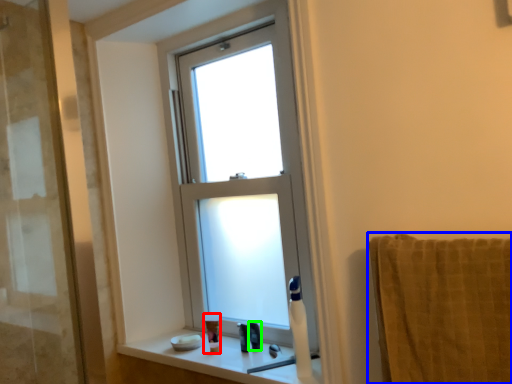
Question: Considering the real-world distances, which object is closest to toiletry (highlighted by a red box)? towel/napkin (highlighted by a blue box) or toiletry (highlighted by a green box).

Choices:
 (A) towel/napkin
 (B) toiletry

Answer: (B)